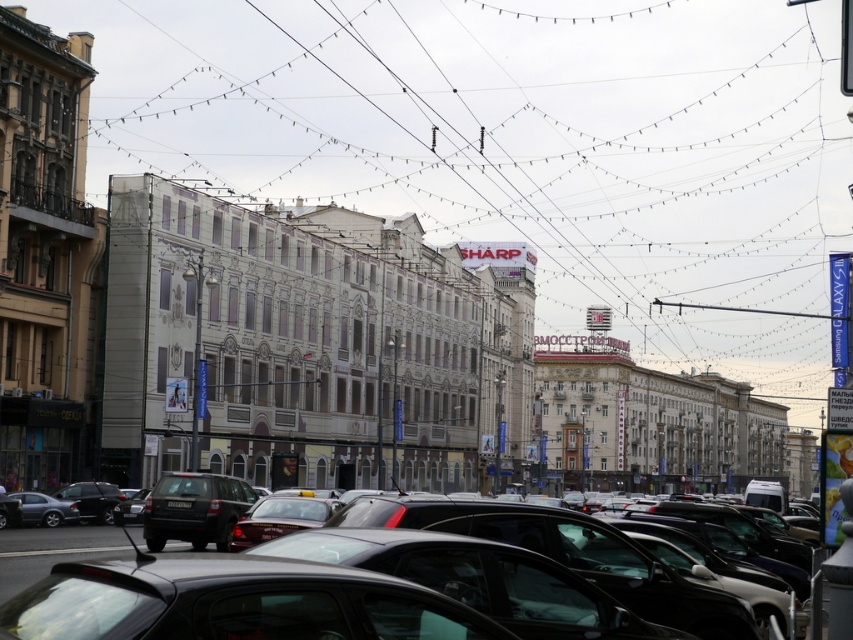
In the scene shown: You are a delivery drone operator. Your drone has a wingspan of 1.2 meters. You need to fly it through the space between the metallic wire at upper center and the shiny black car at center. Can your drone safely pass through that gap?

The metallic wire at upper center is wider than the shiny black car at center. Since the drone has a wingspan of 1.2 meters, the gap between them might be too narrow. However, without knowing the exact distance, it is risky to attempt passage. It is safer to choose a different route to avoid potential collisions.

You are a delivery driver who needs to park your car in the busy street shown in the image. The parking spot you want is located at coordinates 0.873, 0.714. Is the shiny black car at center currently blocking this parking spot?

The shiny black car at center is located exactly at the coordinates (608, 557), so it is blocking the parking spot you want.

You are a delivery person who needs to park your delivery van in this area. The van requires a parking spot that can accommodate vehicles taller than the black plastic license plate at center. Can the shiny black car at center be parked in this spot?

The shiny black car at center is much taller than the black plastic license plate at center, so yes, the parking spot can accommodate the delivery van since the shiny black car at center fits there.